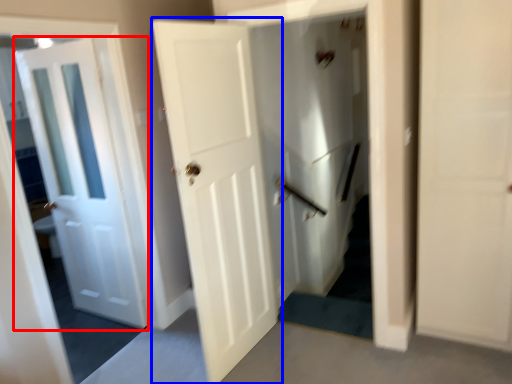
Question: Which object is further to the camera taking this photo, door (highlighted by a red box) or door (highlighted by a blue box)?

Choices:
 (A) door
 (B) door

Answer: (A)